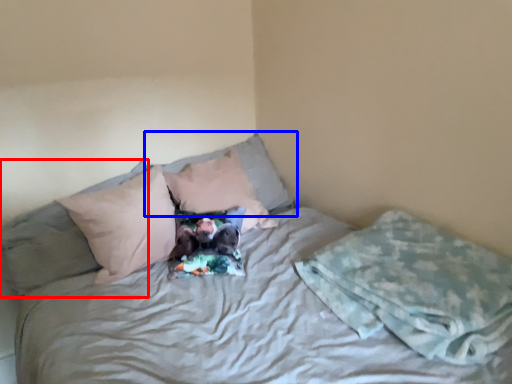
Question: Which of the following is the closest to the observer, pillow (highlighted by a red box) or pillow (highlighted by a blue box)?

Choices:
 (A) pillow
 (B) pillow

Answer: (A)